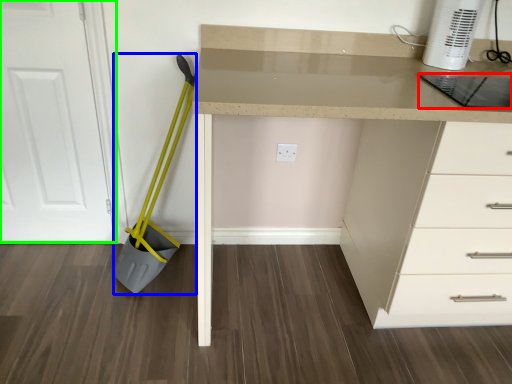
Question: Which is nearer to the kitchen appliance (highlighted by a red box)? shovel (highlighted by a blue box) or door (highlighted by a green box).

Choices:
 (A) shovel
 (B) door

Answer: (A)